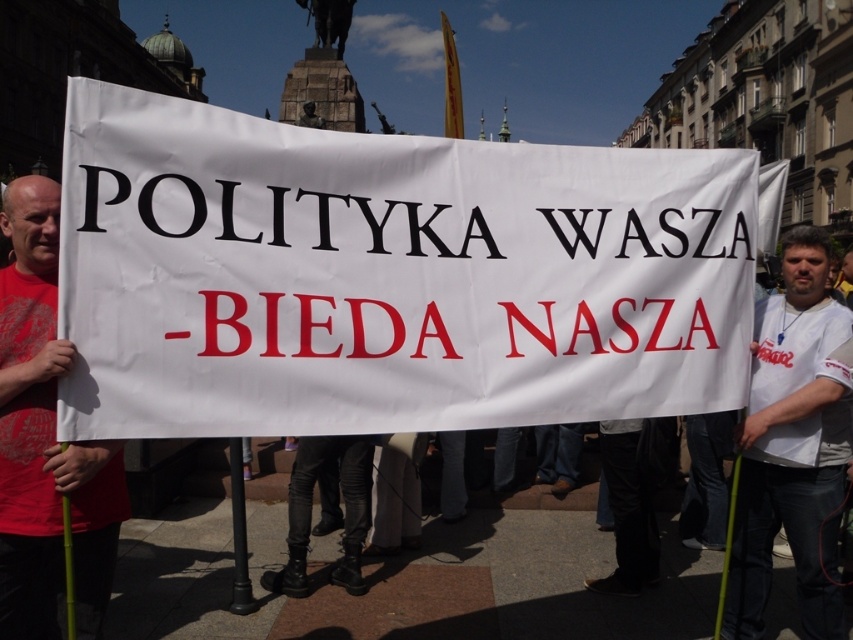
Is white cotton t-shirt at center behind red t-shirt at left?

Yes, white cotton t-shirt at center is further from the viewer.

Does white cotton t-shirt at center have a lesser width compared to red t-shirt at left?

Yes.

You are a GUI agent. You are given a task and a screenshot of the screen. Output one action in this format:
    pyautogui.click(x=<x>, y=<y>)
    Task: Click on the white cotton t-shirt at center
    
    Given the screenshot: What is the action you would take?
    pyautogui.click(x=793, y=445)

Identify the location of white cotton t-shirt at center. (793, 445).

What do you see at coordinates (387, 276) in the screenshot?
I see `white paper banner at center` at bounding box center [387, 276].

Which is more to the right, white paper banner at center or red t-shirt at left?

white paper banner at center is more to the right.

Measure the distance between white paper banner at center and camera.

white paper banner at center and camera are 10.05 feet apart from each other.

What are the coordinates of `white paper banner at center` in the screenshot? It's located at (387, 276).

Who is more forward, (x=729, y=275) or (x=805, y=611)?

Point (x=729, y=275) is more forward.

Consider the image. How far apart are white paper banner at center and white cotton t-shirt at center?

white paper banner at center and white cotton t-shirt at center are 1.70 meters apart from each other.

Which is behind, point (694, 298) or point (843, 624)?

The point (843, 624) is behind.

Locate an element on the screen. This screenshot has width=853, height=640. white paper banner at center is located at coordinates [387, 276].